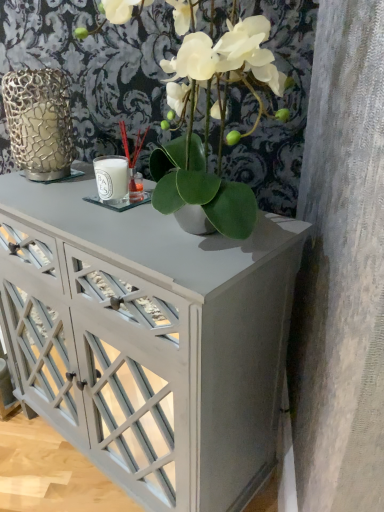
Find the location of a particular element. The width and height of the screenshot is (384, 512). free space above white glossy cabinet at center (from a real-world perspective) is located at coordinates (104, 211).